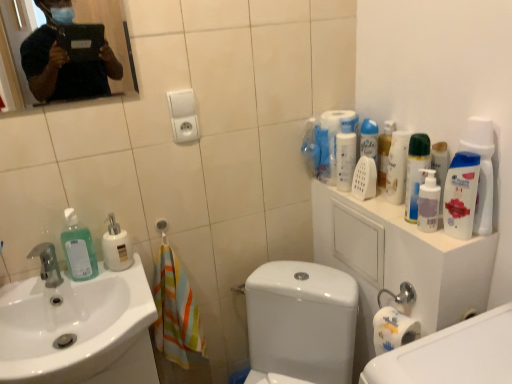
Image resolution: width=512 pixels, height=384 pixels. I want to click on free point in front of white glossy bottle at upper right, which is counted as the 3th cleaning product, starting from the right, so click(x=408, y=223).